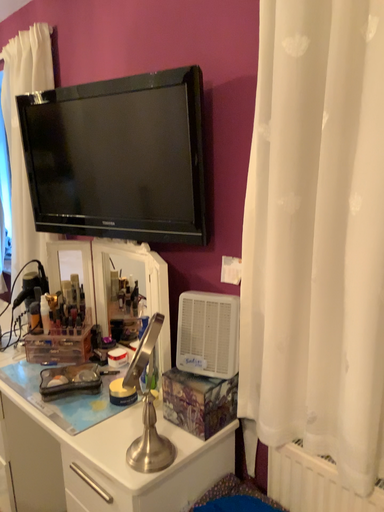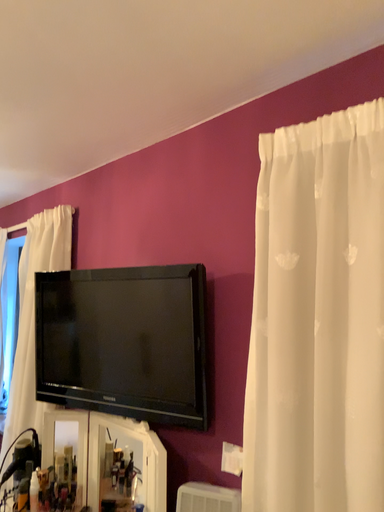
Question: How did the camera likely rotate when shooting the video?

Choices:
 (A) rotated downward
 (B) rotated upward

Answer: (B)